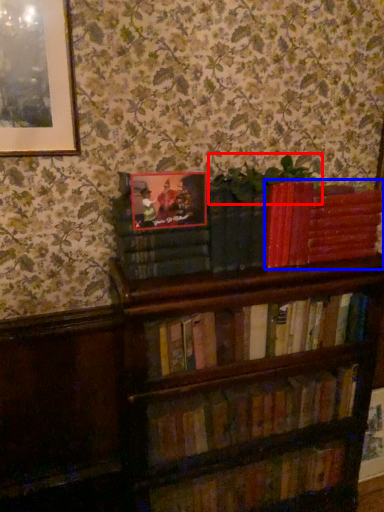
Question: Which object appears closest to the camera in this image, plant (highlighted by a red box) or book (highlighted by a blue box)?

Choices:
 (A) plant
 (B) book

Answer: (A)